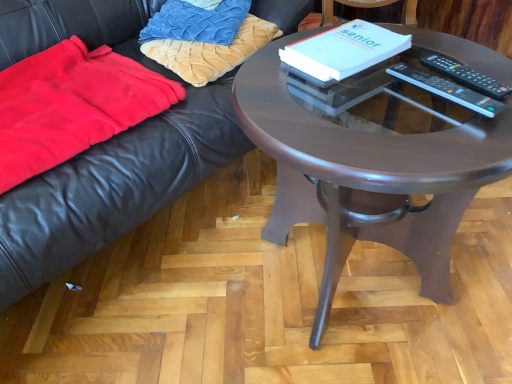
At what (x,y) coordinates should I click in order to perform the action: click on free spot to the left of black plastic remote control at right, which is counted as the first remote control, starting from the left. Please return your answer as a coordinate pair (x, y). Looking at the image, I should click on (324, 119).